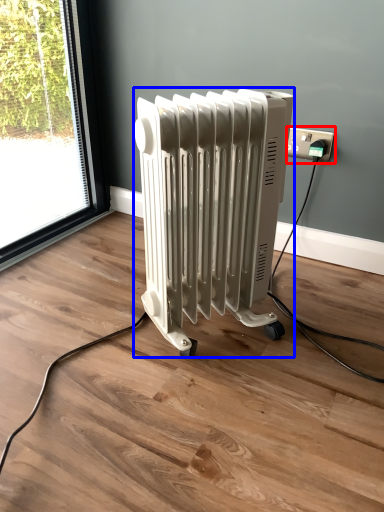
Question: Which object appears farthest to the camera in this image, power plugs and sockets (highlighted by a red box) or radiator (highlighted by a blue box)?

Choices:
 (A) power plugs and sockets
 (B) radiator

Answer: (A)